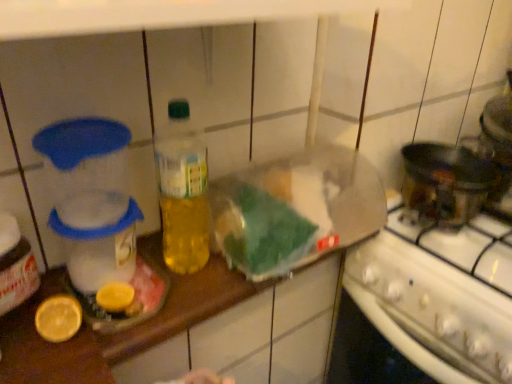
Question: From the image's perspective, is yellow matte lemon at lower left above or below white glossy stove at lower right?

Choices:
 (A) below
 (B) above

Answer: (B)

Question: Considering the positions of yellow matte lemon at lower left and white glossy stove at lower right in the image, is yellow matte lemon at lower left taller or shorter than white glossy stove at lower right?

Choices:
 (A) short
 (B) tall

Answer: (A)

Question: Estimate the real-world distances between objects in this image. Which object is closer to the yellow matte lemon at lower left?

Choices:
 (A) white glossy stove at lower right
 (B) translucent plastic container at left
 (C) translucent plastic bottle at center

Answer: (B)

Question: Which is farther from the translucent plastic container at left?

Choices:
 (A) white glossy stove at lower right
 (B) translucent plastic bottle at center
 (C) yellow matte lemon at lower left

Answer: (A)